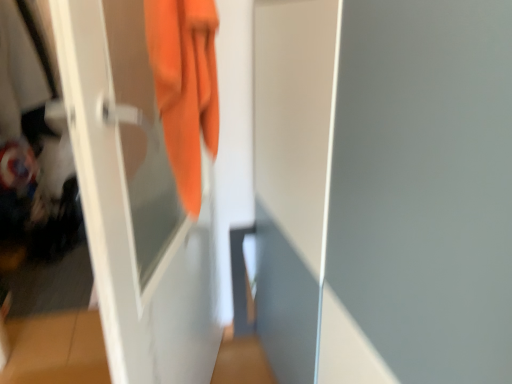
Question: Is white glossy screen door at left, which is counted as the 1th screen door, starting from the left, situated inside orange fabric towel at upper left or outside?

Choices:
 (A) outside
 (B) inside

Answer: (A)

Question: From a real-world perspective, is white glossy screen door at left, which ranks as the second screen door in right-to-left order, physically located above or below orange fabric towel at upper left?

Choices:
 (A) above
 (B) below

Answer: (B)

Question: Estimate the real-world distances between objects in this image. Which object is closer to the white glossy screen door at center, which is counted as the first screen door, starting from the right?

Choices:
 (A) orange fabric towel at upper left
 (B) white glossy screen door at left, which is counted as the 1th screen door, starting from the left

Answer: (A)

Question: Estimate the real-world distances between objects in this image. Which object is closer to the white glossy screen door at left, which is counted as the 1th screen door, starting from the left?

Choices:
 (A) orange fabric towel at upper left
 (B) white glossy screen door at center, which is counted as the first screen door, starting from the right

Answer: (A)